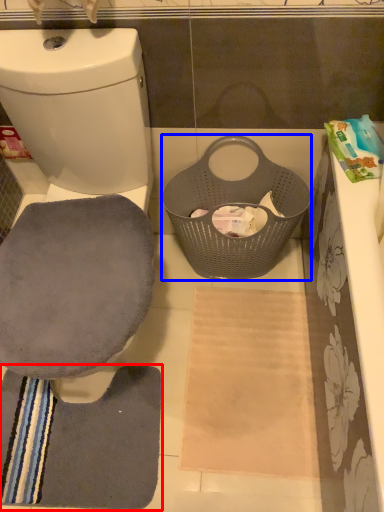
Question: Which object is closer to the camera taking this photo, bath towel (highlighted by a red box) or basket (highlighted by a blue box)?

Choices:
 (A) bath towel
 (B) basket

Answer: (B)